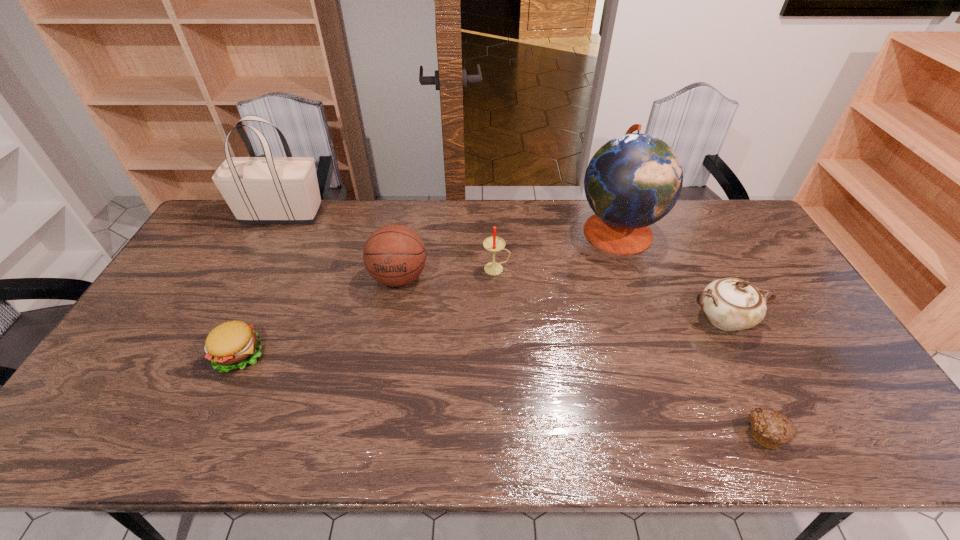
Locate an element on the screen. The height and width of the screenshot is (540, 960). object at the left edge is located at coordinates (259, 190).

Where is `object that is at the right edge`? Image resolution: width=960 pixels, height=540 pixels. object that is at the right edge is located at coordinates (731, 304).

At what (x,y) coordinates should I click in order to perform the action: click on object that is at the far left corner. Please return your answer as a coordinate pair (x, y). This screenshot has width=960, height=540. Looking at the image, I should click on (259, 190).

This screenshot has height=540, width=960. In order to click on free space at the far edge in this screenshot , I will do (344, 201).

Locate an element on the screen. This screenshot has width=960, height=540. vacant space at the near edge of the desktop is located at coordinates (640, 435).

Where is `blank space at the left edge of the desktop`? This screenshot has height=540, width=960. blank space at the left edge of the desktop is located at coordinates (134, 391).

The width and height of the screenshot is (960, 540). Identify the location of free space at the right edge of the desktop. (849, 397).

Locate an element on the screen. The image size is (960, 540). blank area at the far left corner is located at coordinates (228, 238).

The width and height of the screenshot is (960, 540). What are the coordinates of `vacant region between the muffin and the chinaware` in the screenshot? It's located at (744, 376).

You are a GUI agent. You are given a task and a screenshot of the screen. Output one action in this format:
    pyautogui.click(x=<x>, y=<y>)
    Task: Click on the free space between the globe and the basketball
    This screenshot has height=540, width=960.
    Given the screenshot: What is the action you would take?
    pos(508,254)